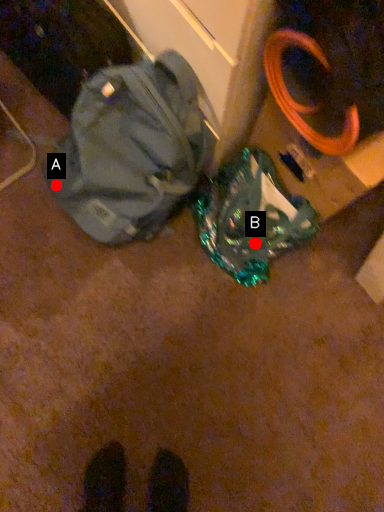
Question: Two points are circled on the image, labeled by A and B beside each circle. Which point is closer to the camera?

Choices:
 (A) A is closer
 (B) B is closer

Answer: (B)